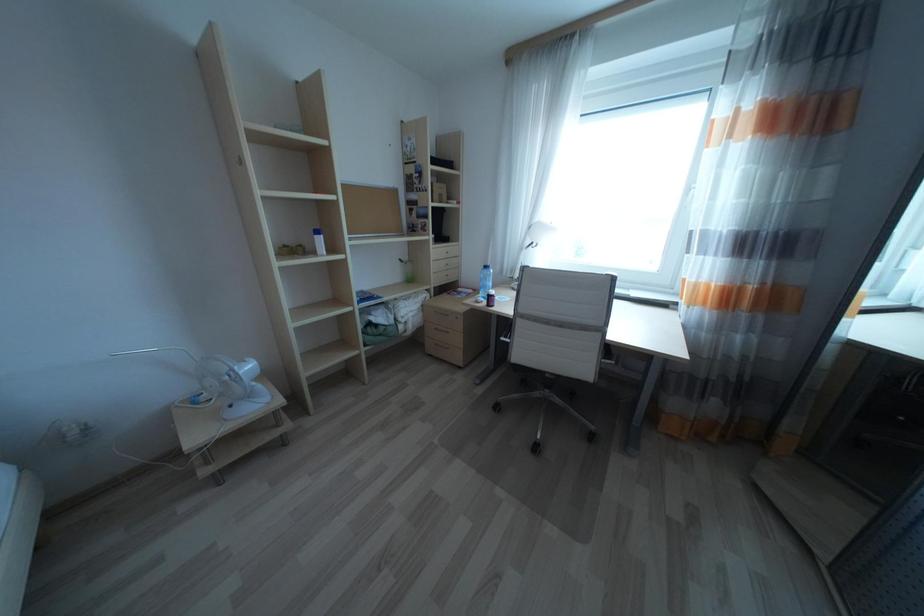
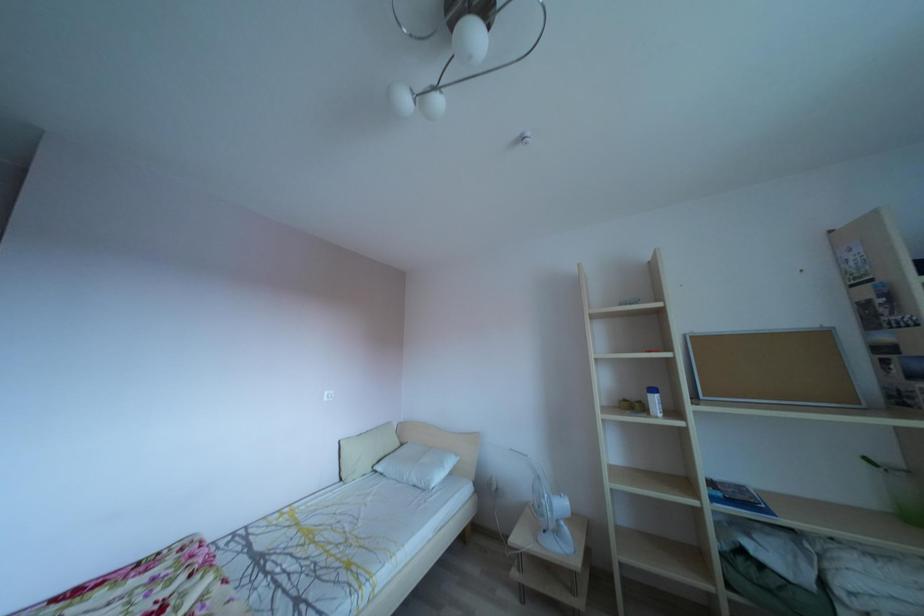
Question: The first image is from the beginning of the video and the second image is from the end. How did the camera likely rotate when shooting the video?

Choices:
 (A) Left
 (B) Right
 (C) Up
 (D) Down

Answer: (A)